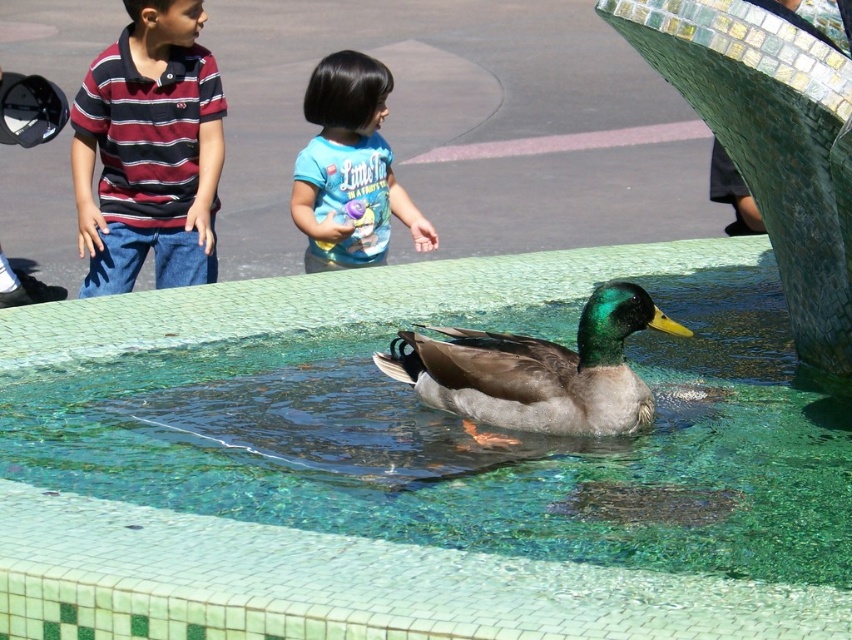
Between green glossy duck at center and blue cotton shirt at upper center, which one appears on the right side from the viewer's perspective?

From the viewer's perspective, green glossy duck at center appears more on the right side.

Does green glossy duck at center appear on the left side of blue cotton shirt at upper center?

No, green glossy duck at center is not to the left of blue cotton shirt at upper center.

Does point (612, 305) come behind point (335, 177)?

No, it is in front of (335, 177).

I want to click on green glossy duck at center, so click(x=537, y=371).

Does green mosaic swimming pool at center lie in front of green glossy duck at center?

No, green mosaic swimming pool at center is further to the viewer.

Does green mosaic swimming pool at center have a smaller size compared to green glossy duck at center?

Correct, green mosaic swimming pool at center occupies less space than green glossy duck at center.

The image size is (852, 640). Identify the location of green mosaic swimming pool at center. (349, 582).

At what (x,y) coordinates should I click in order to perform the action: click on green mosaic swimming pool at center. Please return your answer as a coordinate pair (x, y). This screenshot has width=852, height=640. Looking at the image, I should click on (349, 582).

How distant is striped cotton shirt at upper left from blue cotton shirt at upper center?

striped cotton shirt at upper left and blue cotton shirt at upper center are 1.08 meters apart.

What are the coordinates of `striped cotton shirt at upper left` in the screenshot? It's located at coord(148,150).

Locate an element on the screen. The width and height of the screenshot is (852, 640). striped cotton shirt at upper left is located at coordinates click(x=148, y=150).